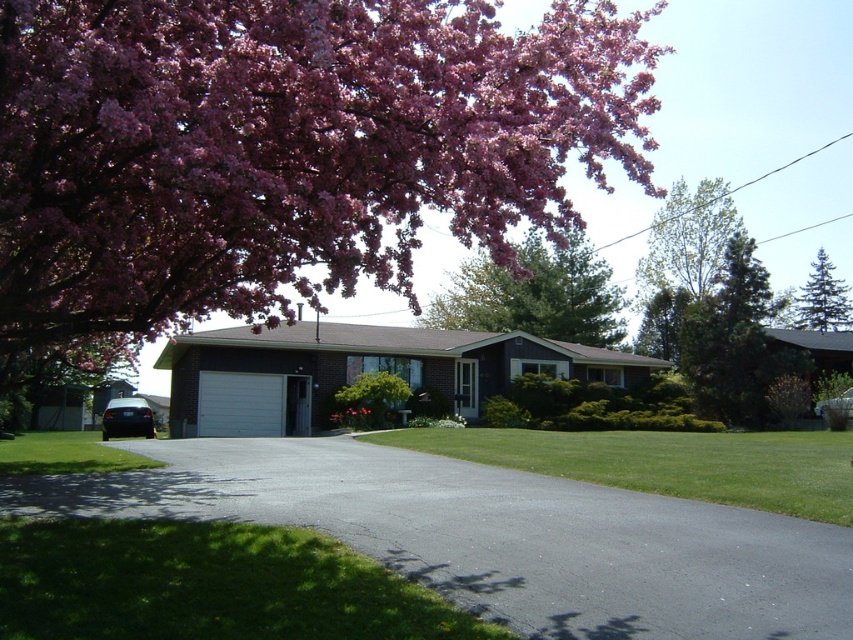
What do you see at coordinates (518, 538) in the screenshot? This screenshot has width=853, height=640. I see `black asphalt driveway at center` at bounding box center [518, 538].

Is point (225, 449) positioned after point (698, 372)?

No, it is in front of (698, 372).

Image resolution: width=853 pixels, height=640 pixels. I want to click on black asphalt driveway at center, so click(518, 538).

Is point (492, 253) positioned before point (672, 502)?

Yes, point (492, 253) is closer to viewer.

Where is `pink bloom at upper left`? The height and width of the screenshot is (640, 853). pink bloom at upper left is located at coordinates (285, 148).

Does green leafy tree at upper right have a smaller size compared to pink matte flower at center?

No, green leafy tree at upper right is not smaller than pink matte flower at center.

Consider the image. Between green leafy tree at upper right and pink matte flower at center, which one appears on the right side from the viewer's perspective?

From the viewer's perspective, green leafy tree at upper right appears more on the right side.

You are a GUI agent. You are given a task and a screenshot of the screen. Output one action in this format:
    pyautogui.click(x=<x>, y=<y>)
    Task: Click on the green leafy tree at upper right
    The image size is (853, 640).
    Given the screenshot: What is the action you would take?
    pyautogui.click(x=682, y=259)